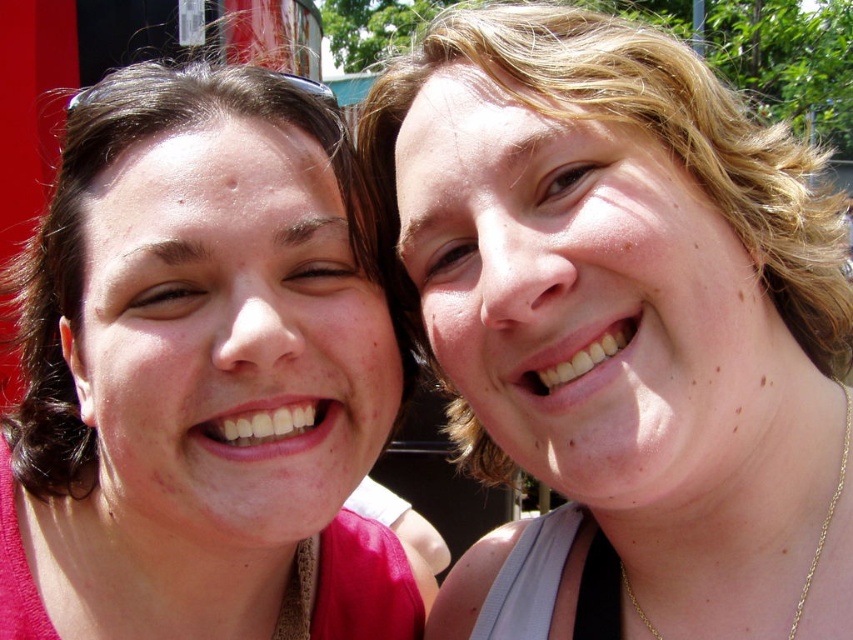
You are a photographer trying to adjust the lighting for a photo shoot. You notice a point at coordinates (x=200, y=376) in the image. According to the scene description, what object is located at that point?

The point at coordinates (x=200, y=376) marks the matte pink shirt at left.

You are a photographer holding a camera. You want to take a portrait of the two people in the image. The camera requires a minimum distance of 1.1 meters to focus properly. Can you focus on the matte skin at center with your current position?

The matte skin at center and camera are 1.06 meters apart from each other. Since the required minimum distance is 1.1 meters, the camera is too close to focus properly on the matte skin at center.

Consider the image. You are standing at point (149, 202) and want to walk to point (782, 634). Is the destination point in front of you?

Yes, the destination point (782, 634) is in front of point (149, 202), so you can walk straight ahead towards it.